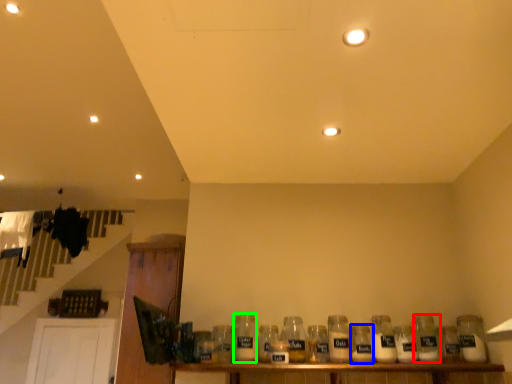
Question: Which object is positioned farthest from bottle (highlighted by a red box)? Select from bottle (highlighted by a blue box) and bottle (highlighted by a green box).

Choices:
 (A) bottle
 (B) bottle

Answer: (B)